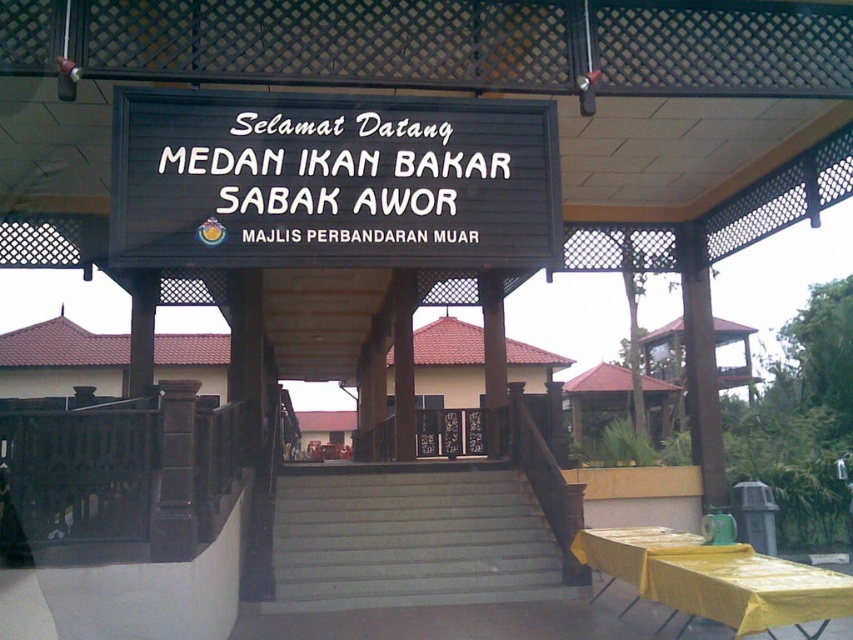
You are at the entrance of the pavilion and want to place a tray of food on the yellow plastic table at lower right. To reach it, you need to go around the gray concrete stairs at center. Which direction should you move relative to the stairs to reach the table?

The gray concrete stairs at center is positioned under the yellow plastic table at lower right, so you should move upward from the stairs to reach the table.

You are a customer approaching the entrance of the pavilion. You see the black wood sign at center and the yellow plastic table at lower right. Which object is located above the other?

The black wood sign at center is positioned over the yellow plastic table at lower right, so the sign is above the table.

You are standing at the entrance of the pavilion and want to take a photo of the signboard. The camera you are using has a focal length of 50mm and a sensor size of 24mm x 36mm. The signboard is located at point (206, 200). Considering the distance between you and the signboard, what is the maximum angle of view required to ensure the entire signboard fits within the camera frame?

The distance between the camera and point (206, 200) is 16.96 feet. To calculate the maximum angle of view, first convert the distance to millimeters. 16.96 feet is approximately 5168.5 mm. The sensor size is 24mm x 36mm. The angle of view can be calculated using the formula tan?2? ??sensor dimension?2? ??distance. For the width, tan?2? ??36?2? ??5168.5? ?0.0035 radians, which is approximately 0.2 degrees. For the height, tan?2? ??24?2? ??5168.5? ?0.0023 radians, approximately 0.13 degrees. The maximum of